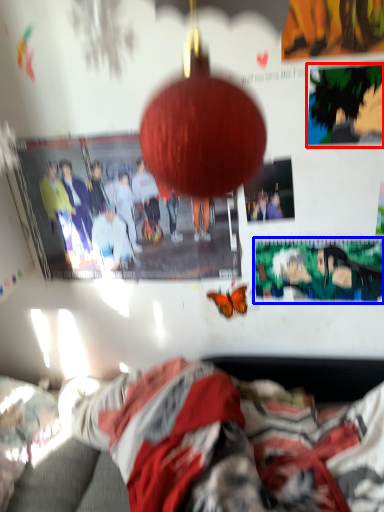
Question: Among these objects, which one is farthest to the camera, poster page (highlighted by a red box) or poster page (highlighted by a blue box)?

Choices:
 (A) poster page
 (B) poster page

Answer: (B)